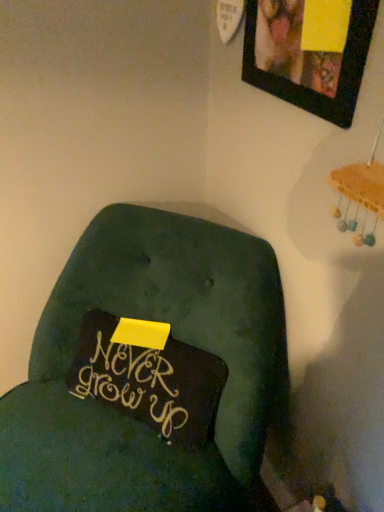
Question: From a real-world perspective, is matte black picture frame at upper right located beneath velvety green cushion at center?

Choices:
 (A) no
 (B) yes

Answer: (A)

Question: Is matte black picture frame at upper right bigger than velvety green cushion at center?

Choices:
 (A) yes
 (B) no

Answer: (B)

Question: Is matte black picture frame at upper right at the left side of velvety green cushion at center?

Choices:
 (A) no
 (B) yes

Answer: (A)

Question: Are matte black picture frame at upper right and velvety green cushion at center located far from each other?

Choices:
 (A) yes
 (B) no

Answer: (B)

Question: Considering the relative sizes of matte black picture frame at upper right and velvety green cushion at center in the image provided, is matte black picture frame at upper right taller than velvety green cushion at center?

Choices:
 (A) no
 (B) yes

Answer: (A)

Question: Is matte black picture frame at upper right with velvety green cushion at center?

Choices:
 (A) yes
 (B) no

Answer: (B)

Question: From the image's perspective, is velvety green cushion at center located above matte black picture frame at upper right?

Choices:
 (A) no
 (B) yes

Answer: (A)

Question: Is velvety green cushion at center further to camera compared to matte black picture frame at upper right?

Choices:
 (A) no
 (B) yes

Answer: (A)

Question: Is velvety green cushion at center to the left of matte black picture frame at upper right from the viewer's perspective?

Choices:
 (A) yes
 (B) no

Answer: (A)

Question: Considering the relative sizes of velvety green cushion at center and matte black picture frame at upper right in the image provided, is velvety green cushion at center smaller than matte black picture frame at upper right?

Choices:
 (A) no
 (B) yes

Answer: (A)

Question: Does velvety green cushion at center have a greater height compared to matte black picture frame at upper right?

Choices:
 (A) yes
 (B) no

Answer: (A)

Question: Is velvety green cushion at center not near matte black picture frame at upper right?

Choices:
 (A) no
 (B) yes

Answer: (A)

Question: Does point (258, 281) appear closer or farther from the camera than point (316, 103)?

Choices:
 (A) closer
 (B) farther

Answer: (B)